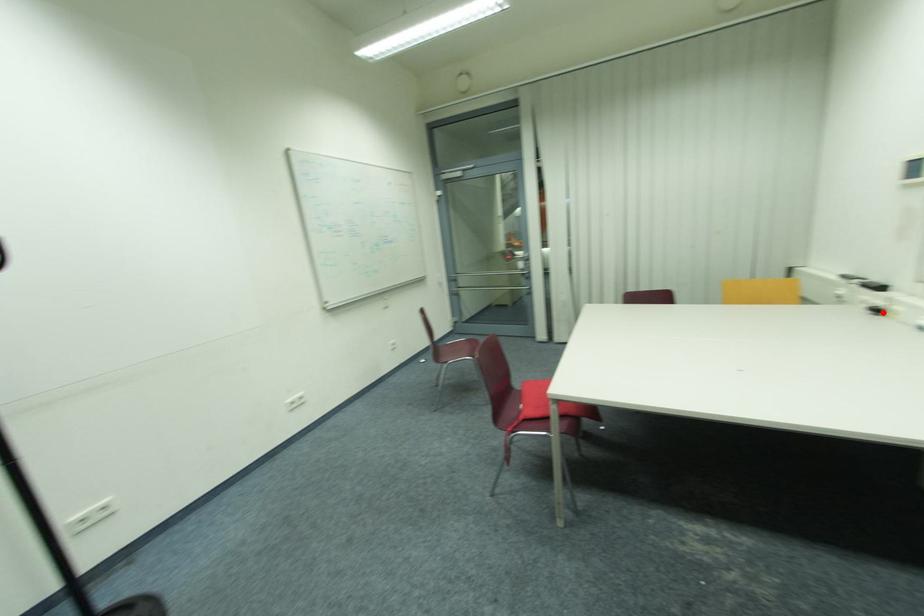
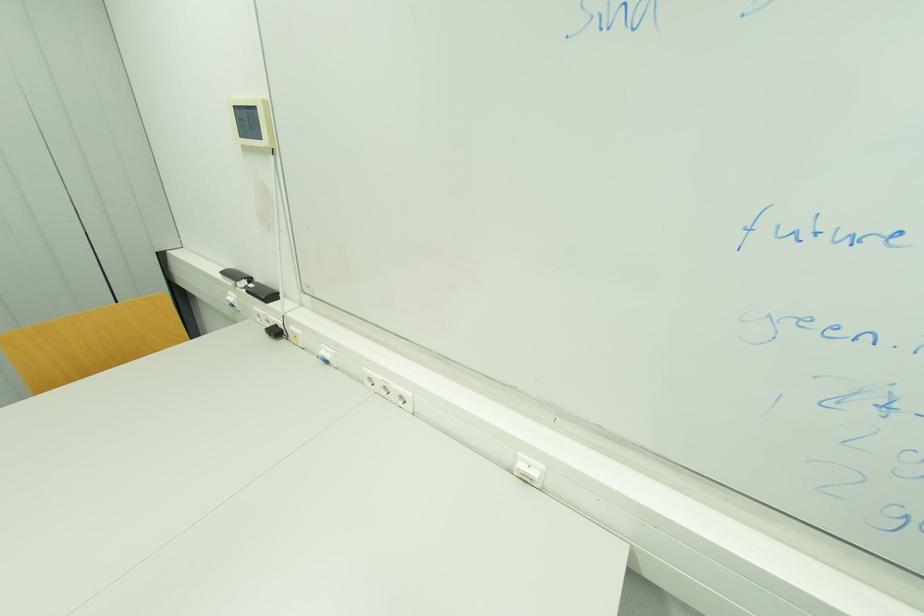
Where in the second image is the point corresponding to the highlighted location from the first image?

(281, 333)